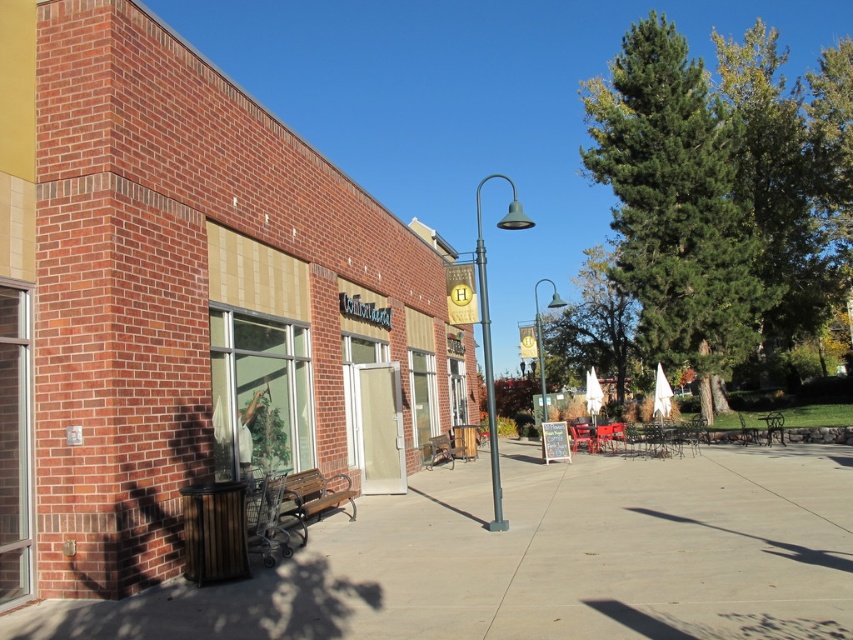
Question: Which of the following is the closest to the observer?

Choices:
 (A) (428, 444)
 (B) (683, 112)
 (C) (590, 256)
 (D) (583, 484)

Answer: (D)

Question: Which point is farther to the camera?

Choices:
 (A) brown wooden bench at lower left
 (B) green leafy tree at upper right

Answer: (B)

Question: Which of the following is the closest to the observer?

Choices:
 (A) green leafy tree at upper right
 (B) brick building at center
 (C) smooth concrete pavement at center
 (D) brown wooden bench at lower left

Answer: (C)

Question: Is the position of green leafy tree at center more distant than that of wooden park bench at center?

Choices:
 (A) yes
 (B) no

Answer: (A)

Question: Can you confirm if brown wooden bench at lower left is bigger than wooden park bench at center?

Choices:
 (A) no
 (B) yes

Answer: (B)

Question: Does brick building at center have a larger size compared to smooth concrete pavement at center?

Choices:
 (A) yes
 (B) no

Answer: (A)